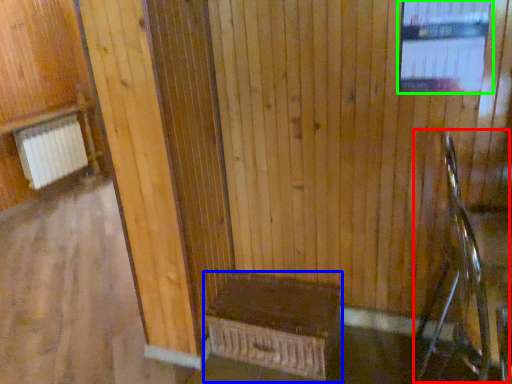
Question: Considering the real-world distances, which object is closest to rocking chair (highlighted by a red box)? furniture (highlighted by a blue box) or window (highlighted by a green box).

Choices:
 (A) furniture
 (B) window

Answer: (B)